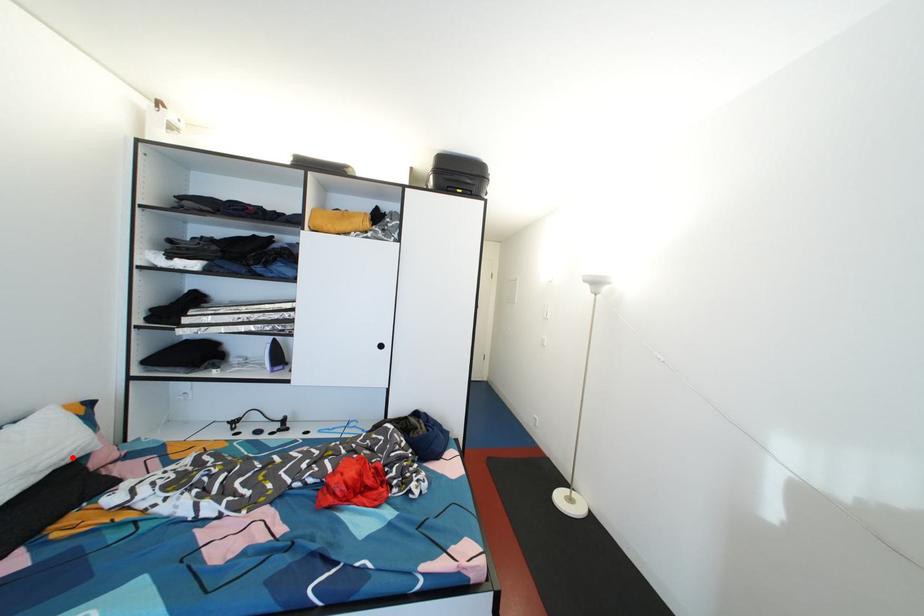
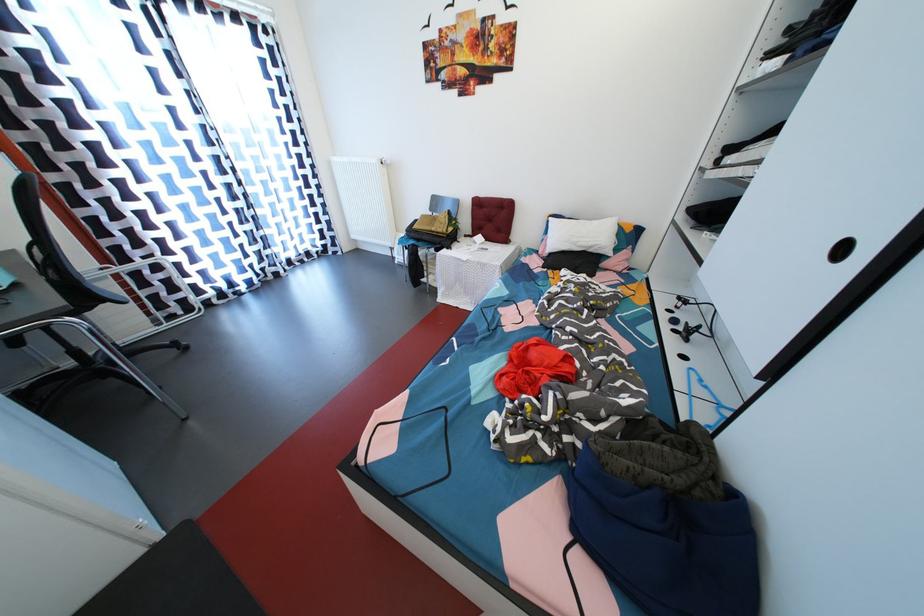
Find the pixel in the second image that matches the highlighted location in the first image.

(597, 249)